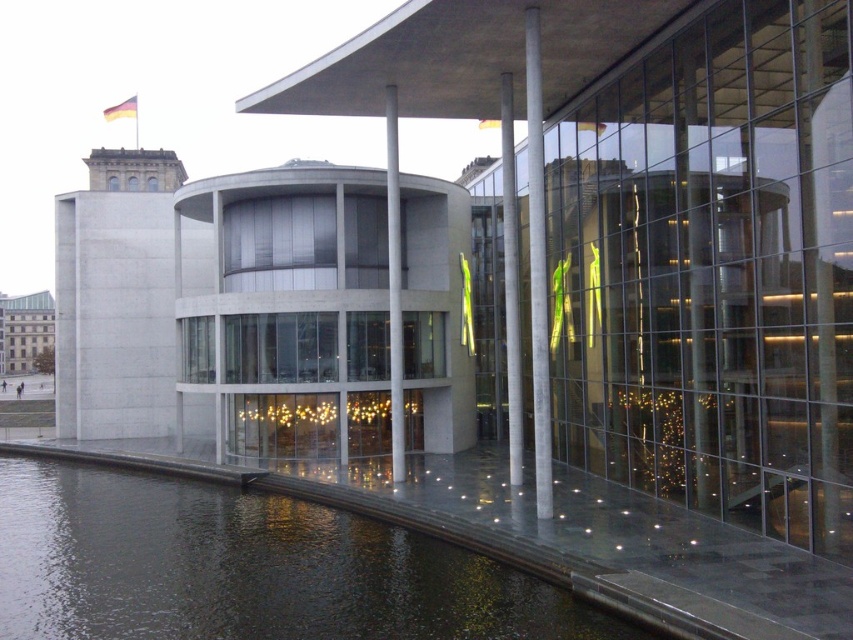
You are an architect analyzing the structural integrity of the building. You notice the concrete pillar at center and the sleek metallic pole at center. Which object is positioned lower in the structure?

The concrete pillar at center is located below the sleek metallic pole at center, so it is positioned lower in the structure.

You are standing in front of the modern architectural structure and want to take a photo. There are two points marked on the building facade at coordinates point (543, 504) and point (518, 340). Which point will appear larger in your photo?

Point (543, 504) is closer to the camera than point (518, 340), so it will appear larger in the photo.